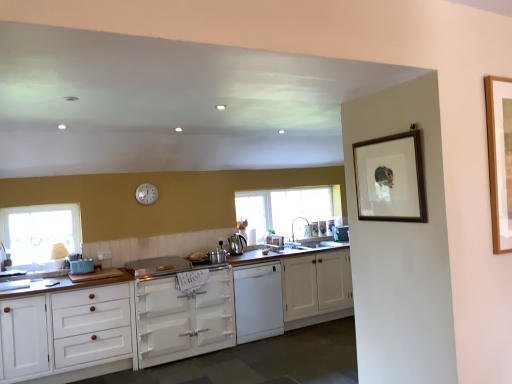
The width and height of the screenshot is (512, 384). What are the coordinates of `free point above clear glass window at center, the 1th window from the right (from a real-world perspective)` in the screenshot? It's located at (276, 182).